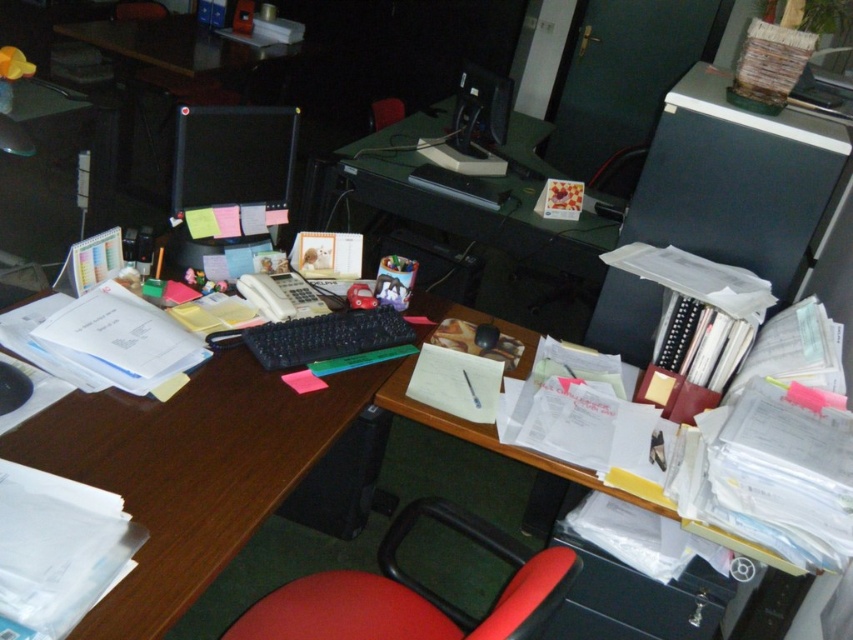
You are a delivery person who needs to place a 1.5 meter long package on the desk. Considering the space between the wooden desk at left and the matte black monitor at upper center, will the package fit horizontally on the desk?

The distance between the wooden desk at left and the matte black monitor at upper center is 1.60 meters. Since the package is 1.5 meters long, it will fit horizontally on the desk as there is enough space.

You are organizing the items on the desk and need to move a heavy box from the wooden desk at left to the matte black monitor at upper center. Which direction should you move the box to place it near the monitor?

You should move the box to the right since the wooden desk at left is positioned to the left of the matte black monitor at upper center, meaning the monitor is to the right of the desk.